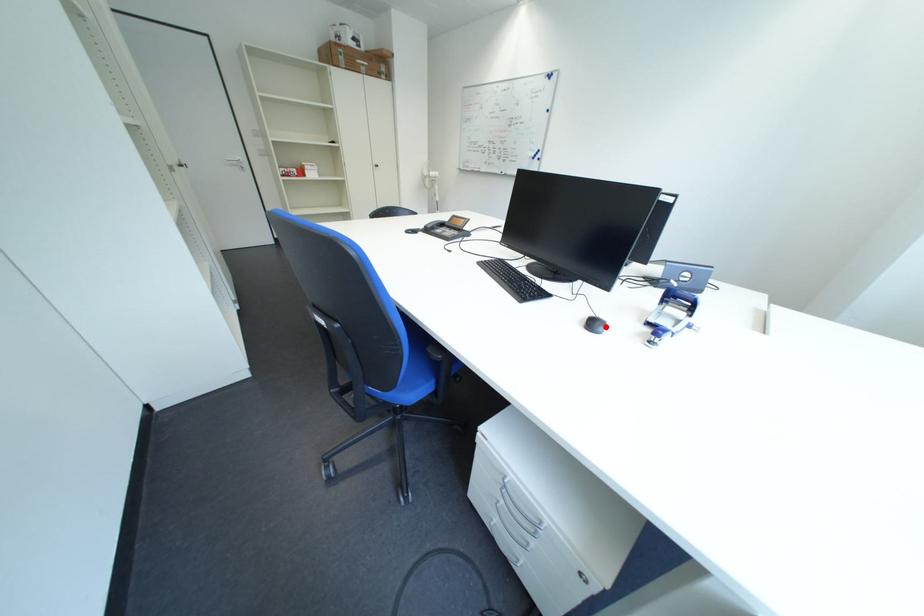
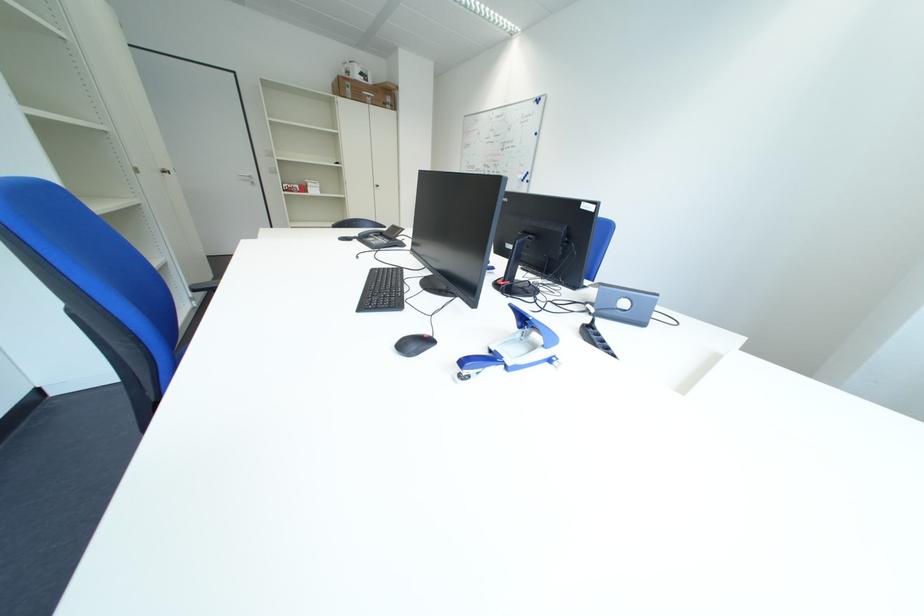
In the second image, find the point that corresponds to the highlighted location in the first image.

(426, 346)